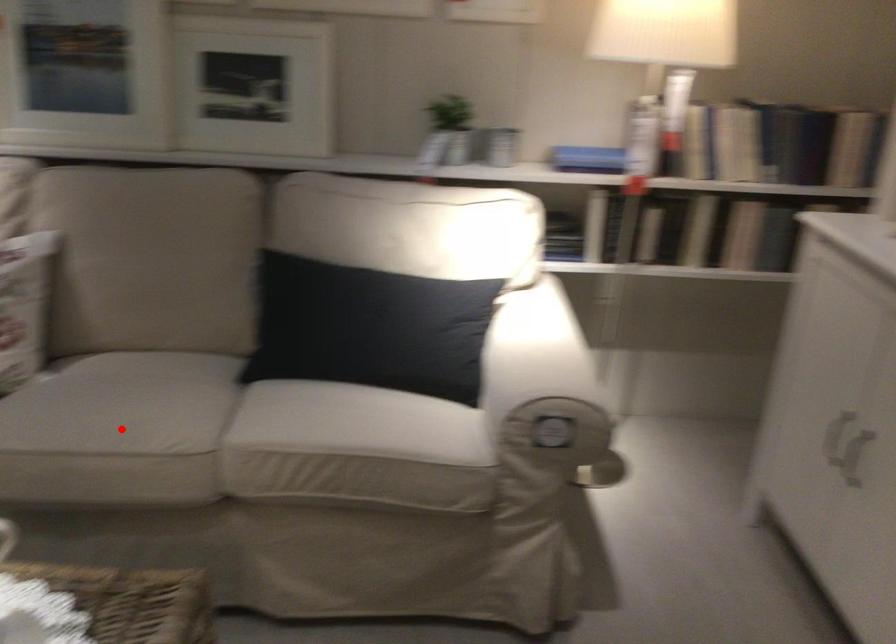
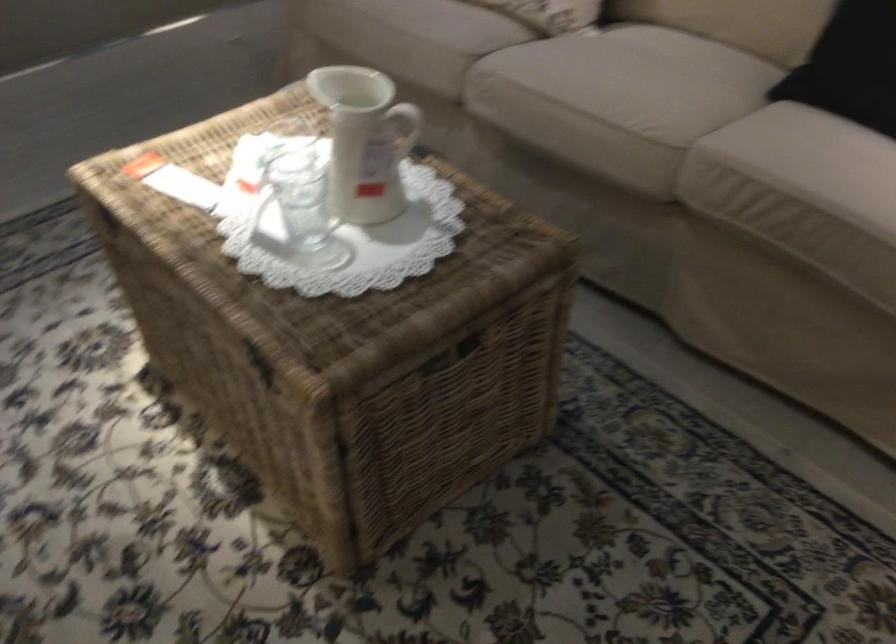
Locate, in the second image, the point that corresponds to the highlighted location in the first image.

(617, 93)